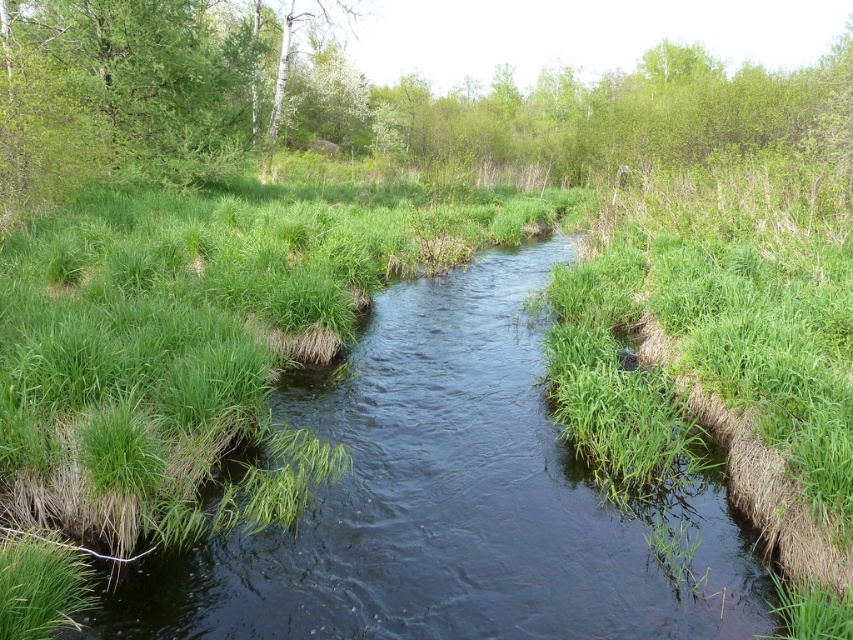
Is green grassy stream at center smaller than green leafy trees at upper center?

Correct, green grassy stream at center occupies less space than green leafy trees at upper center.

Image resolution: width=853 pixels, height=640 pixels. Find the location of `green grassy stream at center`. green grassy stream at center is located at coordinates (450, 500).

Identify the location of green grassy stream at center. (450, 500).